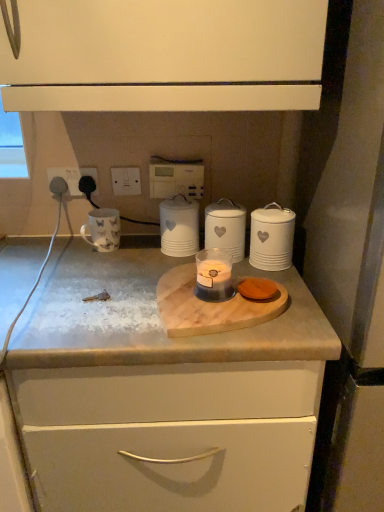
I want to click on vacant space that is to the left of white textured canister at center, positioned as the second home appliance in right-to-left order, so click(x=148, y=262).